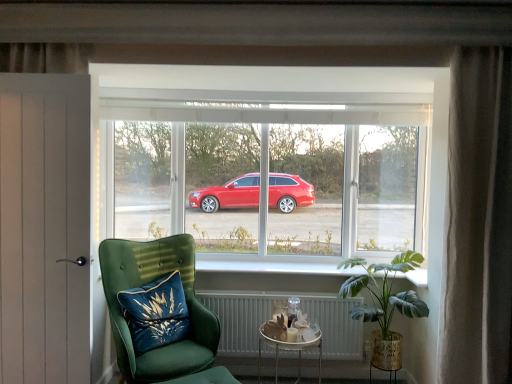
What do you see at coordinates (272, 161) in the screenshot? Image resolution: width=512 pixels, height=384 pixels. I see `transparent glass window at center` at bounding box center [272, 161].

The width and height of the screenshot is (512, 384). In order to click on white metallic radiator at lower center in this screenshot , I will do `click(240, 318)`.

What is the approximate height of white painted wood door at left?

It is 1.70 meters.

Image resolution: width=512 pixels, height=384 pixels. What do you see at coordinates (156, 313) in the screenshot?
I see `blue velvet cushion at lower left` at bounding box center [156, 313].

You are a GUI agent. You are given a task and a screenshot of the screen. Output one action in this format:
    pyautogui.click(x=<x>, y=<y>)
    Task: Click on the silky beige curtain at right
    This screenshot has width=512, height=384.
    Given the screenshot: What is the action you would take?
    pyautogui.click(x=479, y=220)

Looking at this image, which object is thinner, white metallic radiator at lower center or green leafy plant at lower right?

Thinner between the two is white metallic radiator at lower center.

In the scene shown: Is there a large distance between white metallic radiator at lower center and green leafy plant at lower right?

No.

From the image's perspective, which one is positioned lower, white metallic radiator at lower center or green leafy plant at lower right?

white metallic radiator at lower center, from the image's perspective.

From a real-world perspective, who is located lower, silky beige curtain at right or transparent glass window at center?

silky beige curtain at right, from a real-world perspective.

Is silky beige curtain at right oriented away from transparent glass window at center?

That's right, silky beige curtain at right is facing away from transparent glass window at center.

Which object is wider, silky beige curtain at right or transparent glass window at center?

silky beige curtain at right is wider.

Does point (290, 350) lie behind point (185, 254)?

That is True.

Is metallic silver tray at lower center surrounding velvet green armchair at lower left?

Definitely not — velvet green armchair at lower left is not inside metallic silver tray at lower center.

Is the position of metallic silver tray at lower center more distant than that of velvet green armchair at lower left?

Yes, it is behind velvet green armchair at lower left.

Considering the relative sizes of metallic silver tray at lower center and velvet green armchair at lower left in the image provided, is metallic silver tray at lower center thinner than velvet green armchair at lower left?

Correct, the width of metallic silver tray at lower center is less than that of velvet green armchair at lower left.

Can you confirm if green leafy plant at lower right is wider than white painted wood door at left?

Yes, green leafy plant at lower right is wider than white painted wood door at left.

In the scene shown: Is green leafy plant at lower right placed right next to white painted wood door at left?

No, green leafy plant at lower right is not in contact with white painted wood door at left.

Is green leafy plant at lower right positioned beyond the bounds of white painted wood door at left?

green leafy plant at lower right lies outside white painted wood door at left's area.

Considering the positions of objects green leafy plant at lower right and white painted wood door at left in the image provided, who is behind, green leafy plant at lower right or white painted wood door at left?

green leafy plant at lower right is more distant.

What's the angular difference between metallic silver tray at lower center and white painted wood door at left's facing directions?

They differ by 2.45 degrees in their facing directions.

Which of these two, metallic silver tray at lower center or white painted wood door at left, stands shorter?

Standing shorter between the two is metallic silver tray at lower center.

Is metallic silver tray at lower center inside the boundaries of white painted wood door at left, or outside?

metallic silver tray at lower center is spatially situated outside white painted wood door at left.

In terms of width, does metallic silver tray at lower center look wider or thinner when compared to white painted wood door at left?

Clearly, metallic silver tray at lower center has more width compared to white painted wood door at left.

Could you tell me if white painted wood door at left is turned towards velvet green armchair at lower left?

No, white painted wood door at left is not facing towards velvet green armchair at lower left.

From the picture: From a real-world perspective, is white painted wood door at left above or below velvet green armchair at lower left?

From a real-world perspective, white painted wood door at left is physically above velvet green armchair at lower left.

Is white painted wood door at left taller or shorter than velvet green armchair at lower left?

In the image, white painted wood door at left appears to be taller than velvet green armchair at lower left.

Looking at this image, is silky beige curtain at right thinner than metallic silver tray at lower center?

Indeed, silky beige curtain at right has a lesser width compared to metallic silver tray at lower center.

Is silky beige curtain at right next to metallic silver tray at lower center?

No, silky beige curtain at right is not next to metallic silver tray at lower center.

From a real-world perspective, is silky beige curtain at right physically located above or below metallic silver tray at lower center?

silky beige curtain at right is above metallic silver tray at lower center.

Does silky beige curtain at right have a lesser height compared to metallic silver tray at lower center?

No.

Locate an element on the screen. This screenshot has height=384, width=512. houseplant on the right of white metallic radiator at lower center is located at coordinates 384,303.

The height and width of the screenshot is (384, 512). In order to click on curtain below the transparent glass window at center (from the image's perspective) in this screenshot , I will do `click(479, 220)`.

When comparing their distances from metallic silver tray at lower center, does white painted wood door at left or velvet green armchair at lower left seem further?

white painted wood door at left is positioned further to the anchor metallic silver tray at lower center.

Looking at the image, which one is located closer to white metallic radiator at lower center, velvet green armchair at lower left or white painted wood door at left?

The object closer to white metallic radiator at lower center is velvet green armchair at lower left.

Which object lies further to the anchor point silky beige curtain at right, white glossy window sill at center or transparent glass window at center?

The object further to silky beige curtain at right is white glossy window sill at center.

Looking at this image, from the image, which object appears to be nearer to silky beige curtain at right, velvet green armchair at lower left or white painted wood door at left?

velvet green armchair at lower left.

Considering their positions, is white metallic radiator at lower center positioned further to white painted wood door at left than silky beige curtain at right?

Based on the image, silky beige curtain at right appears to be further to white painted wood door at left.

Estimate the real-world distances between objects in this image. Which object is closer to velvet green armchair at lower left, blue velvet cushion at lower left or white painted wood door at left?

blue velvet cushion at lower left lies closer to velvet green armchair at lower left than the other object.

When comparing their distances from green leafy plant at lower right, does white glossy window sill at center or silky beige curtain at right seem closer?

Based on the image, white glossy window sill at center appears to be nearer to green leafy plant at lower right.

Looking at the image, which one is located further to velvet green armchair at lower left, white painted wood door at left or green leafy plant at lower right?

Among the two, green leafy plant at lower right is located further to velvet green armchair at lower left.

What are the coordinates of `window sill between white metallic radiator at lower center and green leafy plant at lower right` in the screenshot? It's located at (267, 273).

You are a GUI agent. You are given a task and a screenshot of the screen. Output one action in this format:
    pyautogui.click(x=<x>, y=<y>)
    Task: Click on the table between white painted wood door at left and silky beige curtain at right
    Image resolution: width=512 pixels, height=384 pixels.
    Given the screenshot: What is the action you would take?
    pyautogui.click(x=289, y=350)

Identify the location of window sill between metallic silver tray at lower center and silky beige curtain at right. (267, 273).

The height and width of the screenshot is (384, 512). I want to click on window sill located between transparent glass window at center and silky beige curtain at right in the left-right direction, so click(x=267, y=273).